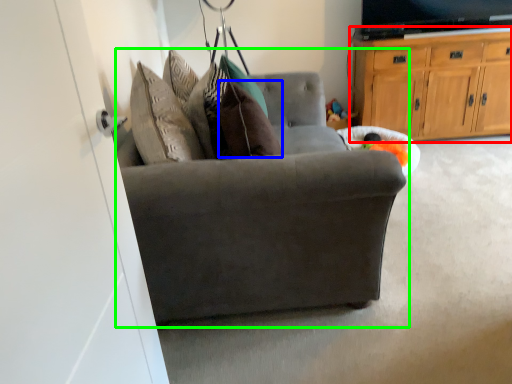
Question: Which object is the farthest from cabinetry (highlighted by a red box)? Choose among these: pillow (highlighted by a blue box) or chair (highlighted by a green box).

Choices:
 (A) pillow
 (B) chair

Answer: (A)